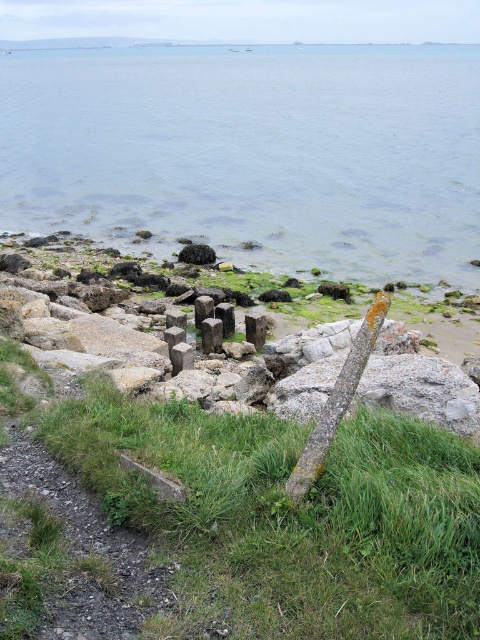
Question: Estimate the real-world distances between objects in this image. Which object is farther from the brown mossy pole at center?

Choices:
 (A) clear water at lower center
 (B) green grass at lower center

Answer: (A)

Question: Can you confirm if clear water at lower center is wider than green grass at lower center?

Choices:
 (A) yes
 (B) no

Answer: (A)

Question: Among these objects, which one is nearest to the camera?

Choices:
 (A) green grass at lower center
 (B) brown mossy pole at center
 (C) clear water at lower center

Answer: (A)

Question: Based on their relative distances, which object is nearer to the clear water at lower center?

Choices:
 (A) brown mossy pole at center
 (B) green grass at lower center

Answer: (B)

Question: Is clear water at lower center behind green grass at lower center?

Choices:
 (A) no
 (B) yes

Answer: (B)

Question: Can you confirm if clear water at lower center is bigger than green grass at lower center?

Choices:
 (A) yes
 (B) no

Answer: (A)